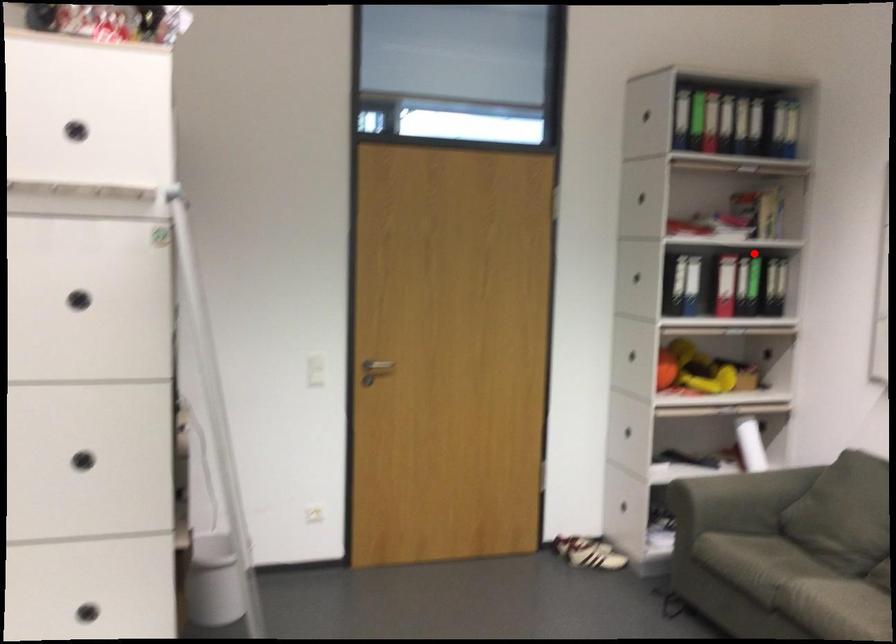
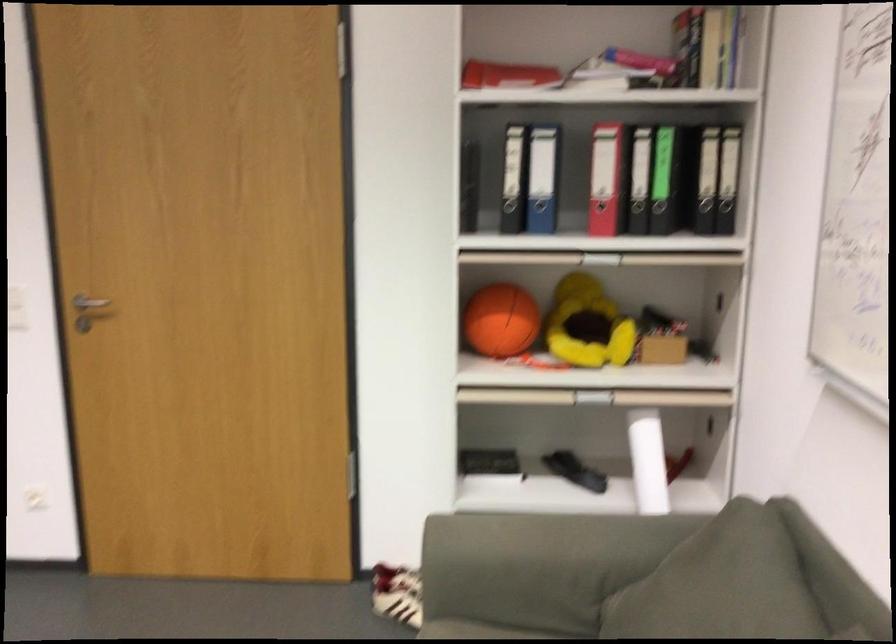
Question: I am providing you with two images of the same scene from different viewpoints. A red point is shown in image1. For the corresponding object point in image2, is it positioned nearer or farther from the camera?

Choices:
 (A) Nearer
 (B) Farther

Answer: (A)